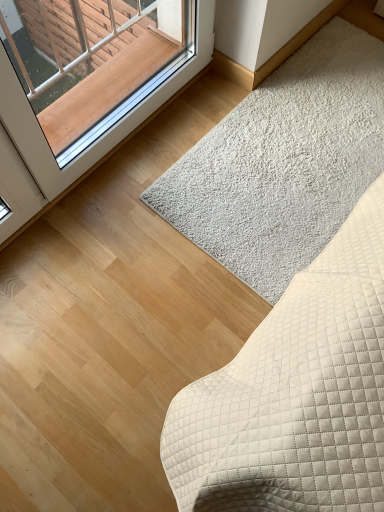
At what (x,y) coordinates should I click in order to perform the action: click on white shaggy rug at center. Please return your answer as a coordinate pair (x, y). Looking at the image, I should click on (284, 162).

The width and height of the screenshot is (384, 512). Describe the element at coordinates (284, 162) in the screenshot. I see `white shaggy rug at center` at that location.

The image size is (384, 512). Identify the location of white shaggy rug at center. (284, 162).